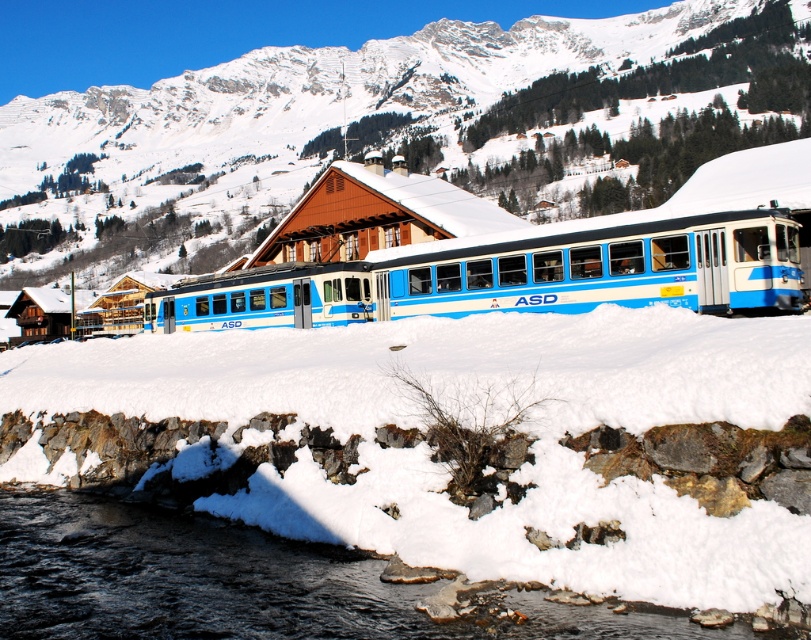
From the picture: You are standing at the point marked as point (288, 618) and want to walk to the point marked as point (786, 291). Given the snowy terrain, which direction should you face to move towards your destination?

You should face downward because point (288, 618) is closer to the camera than point (786, 291), meaning the destination is further away from the camera. In an image, moving away from the camera typically corresponds to moving downward in the frame.

You are standing at the viewpoint where the image was taken. The train is 10 meters long. Can the entire train fit between you and the snowy mountain at upper center?

The distance between the viewer and the snowy mountain at upper center is 50.29 meters. Since the train is only 10 meters long, the entire train can easily fit within that distance.